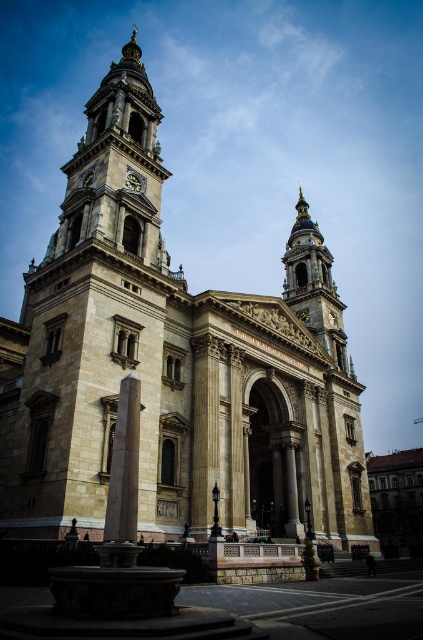
Is golden stone tower at center above smooth stone column at center?

Yes.

Based on the photo, can you confirm if golden stone tower at center is taller than smooth stone column at center?

Yes, golden stone tower at center is taller than smooth stone column at center.

The image size is (423, 640). Find the location of `golden stone tower at center`. golden stone tower at center is located at coordinates (313, 285).